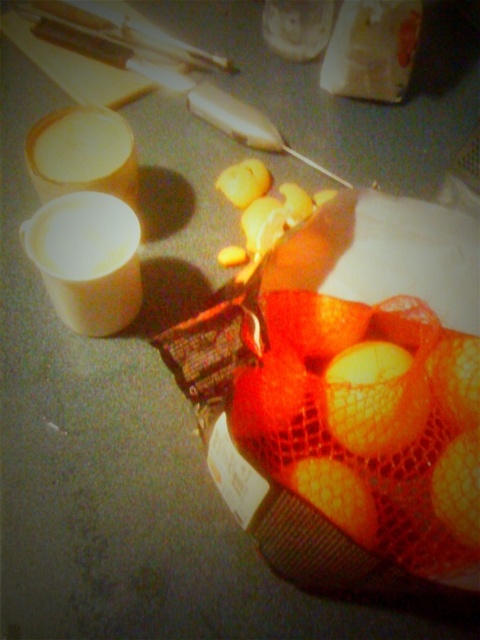
Question: Which point is farther to the camera?

Choices:
 (A) (389, 321)
 (B) (443, 499)
 (C) (396, 404)

Answer: (A)

Question: Which is farther from the orange netted at center?

Choices:
 (A) white mesh bag at upper center
 (B) orange mesh bag at center
 (C) orange matte mesh bag at center
 (D) orange netted bag at center

Answer: (A)

Question: Is orange netted at center in front of orange netted bag at center?

Choices:
 (A) no
 (B) yes

Answer: (A)

Question: Is yellow mesh bag at center above orange netted bag at center?

Choices:
 (A) yes
 (B) no

Answer: (A)

Question: From the image, what is the correct spatial relationship of orange matte mesh bag at center in relation to orange netted bag at center?

Choices:
 (A) above
 (B) below

Answer: (B)

Question: Which point is farther to the camera?

Choices:
 (A) yellow mesh bag at center
 (B) white mesh bag at upper center
 (C) orange netted at center
 (D) orange netted bag at center

Answer: (B)